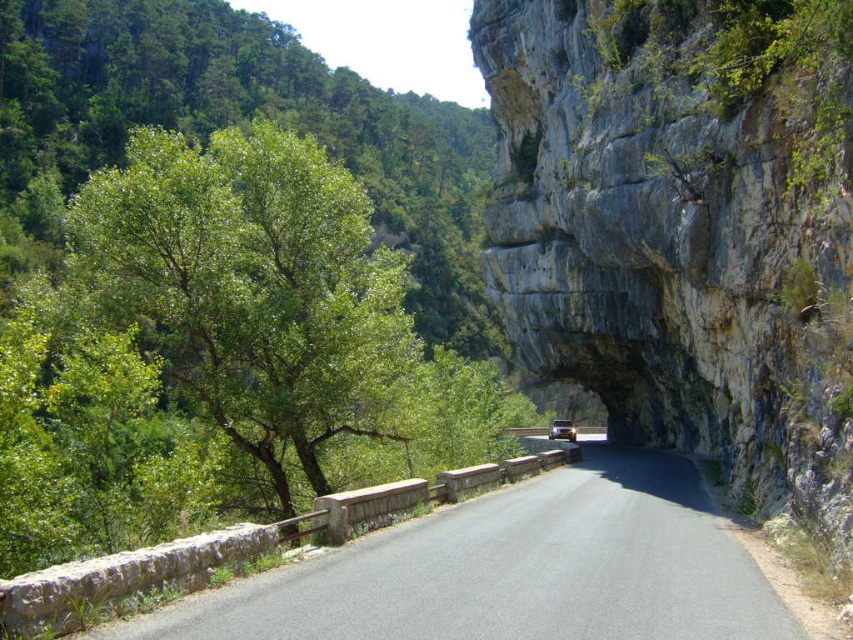
You are standing at the camera position and want to reach the point at coordinates (718, 108). Given that your walking speed is 1.5 meters per second, approximately how many seconds will it take you to reach that point?

The point at coordinates (718, 108) is 22.85 meters away from the camera. At a walking speed of 1.5 meters per second, it would take approximately 15.23 seconds to reach that point.

You are driving a metallic gold car at center and want to park it on the asphalt road at center. Is there enough space between them to park safely?

The asphalt road at center and metallic gold car at center are 48.21 meters apart from each other, so there is sufficient space to park the metallic gold car at center safely.

Based on the photo, you are driving a metallic gold car at center on an asphalt road at center. The road leads to a rocky overhang ahead. Can you safely drive your car through the tunnel formed by the overhang?

The asphalt road at center is in front of the metallic gold car at center, meaning the car is positioned behind the road. Since the road leads into the tunnel formed by the rocky overhang, the metallic gold car at center can safely drive forward along the asphalt road at center to enter the tunnel.